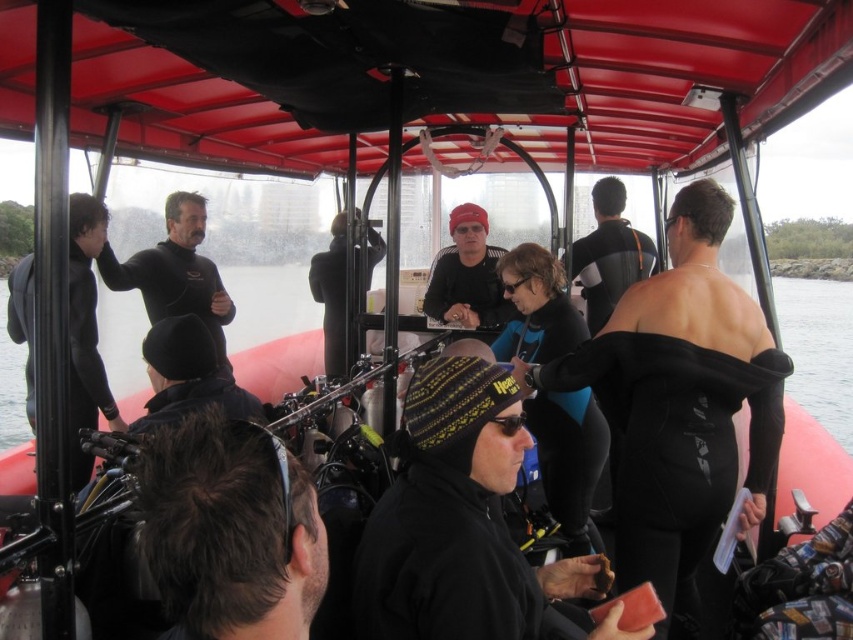
Question: Is black wetsuit at left closer to camera compared to matte black beanie at center?

Choices:
 (A) yes
 (B) no

Answer: (A)

Question: Is black wetsuit at left bigger than matte black beanie at center?

Choices:
 (A) yes
 (B) no

Answer: (A)

Question: Which object appears closest to the camera in this image?

Choices:
 (A) matte black beanie at center
 (B) black wetsuit at left

Answer: (B)

Question: Does black wetsuit at left have a lesser width compared to matte black beanie at center?

Choices:
 (A) no
 (B) yes

Answer: (A)

Question: Which point is closer to the camera taking this photo?

Choices:
 (A) (177, 250)
 (B) (467, 252)

Answer: (A)